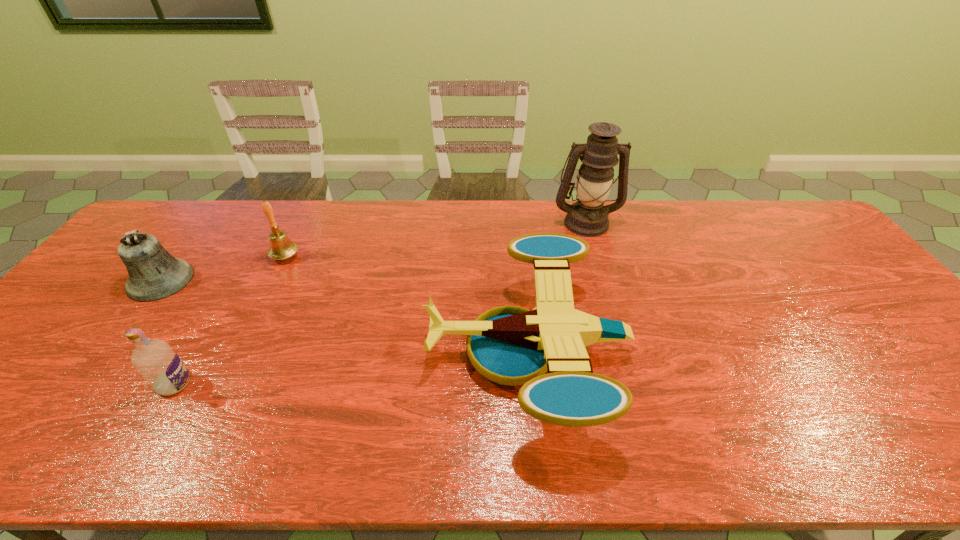
Locate an element on the screen. vacant region located on the right of the leftmost object is located at coordinates (219, 280).

Where is `blank space located 0.070m at the cockpit of the drone`? blank space located 0.070m at the cockpit of the drone is located at coordinates (399, 351).

At what (x,y) coordinates should I click in order to perform the action: click on vacant area located 0.280m at the cockpit of the drone. Please return your answer as a coordinate pair (x, y). Looking at the image, I should click on (314, 351).

This screenshot has height=540, width=960. I want to click on vacant space located at the cockpit of the drone, so click(x=391, y=351).

Where is `object that is at the far edge`? object that is at the far edge is located at coordinates (587, 217).

Identify the location of object located at the near edge. The image size is (960, 540). (517, 349).

The width and height of the screenshot is (960, 540). In order to click on object present at the left edge in this screenshot , I will do `click(154, 274)`.

Where is `free spot at the far edge of the desktop`? Image resolution: width=960 pixels, height=540 pixels. free spot at the far edge of the desktop is located at coordinates (330, 213).

At what (x,y) coordinates should I click in order to perform the action: click on vacant region at the near edge. Please return your answer as a coordinate pair (x, y). Looking at the image, I should click on (491, 436).

In the image, there is a desktop. Where is `free region at the left edge`? free region at the left edge is located at coordinates (99, 343).